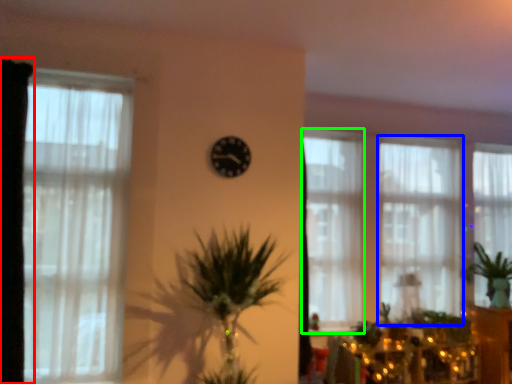
Question: Which object is positioned closest to curtain (highlighted by a red box)? Select from window (highlighted by a blue box) and window (highlighted by a green box).

Choices:
 (A) window
 (B) window

Answer: (B)